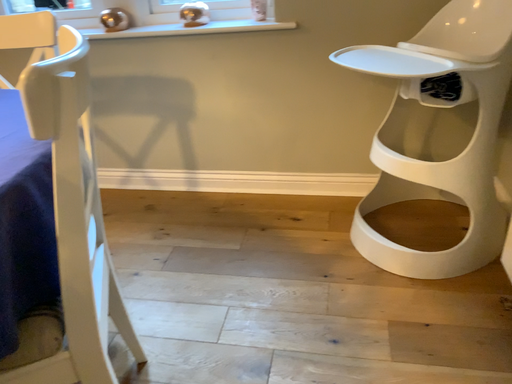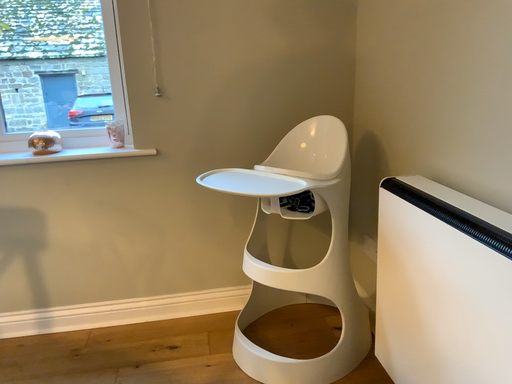
Question: Which way did the camera rotate in the video?

Choices:
 (A) rotated right
 (B) rotated left

Answer: (A)